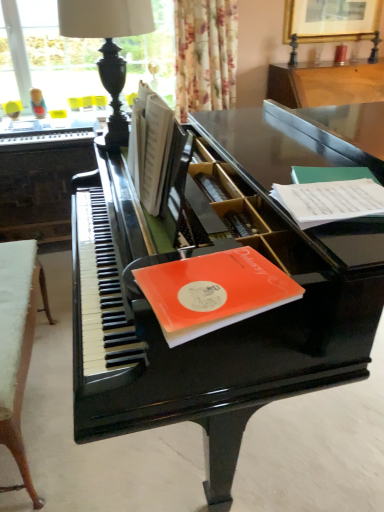
Question: Considering the relative sizes of white paper at right, marked as the second paperback book in a front-to-back arrangement, and white paper book at center in the image provided, is white paper at right, marked as the second paperback book in a front-to-back arrangement, bigger than white paper book at center?

Choices:
 (A) no
 (B) yes

Answer: (A)

Question: Is white paper at right, the second paperback book positioned from the left, closer to camera compared to white paper book at center?

Choices:
 (A) yes
 (B) no

Answer: (A)

Question: Is white paper at right, the first paperback book from the right, wider than white paper book at center?

Choices:
 (A) yes
 (B) no

Answer: (A)

Question: Does white paper at right, the second paperback book positioned from the left, have a lesser width compared to white paper book at center?

Choices:
 (A) no
 (B) yes

Answer: (A)

Question: Is white paper at right, marked as the second paperback book in a front-to-back arrangement, at the left side of white paper book at center?

Choices:
 (A) yes
 (B) no

Answer: (B)

Question: Looking at the image, does black polished wood table lamp at upper left seem bigger or smaller compared to orange matte paper at piano top, placed as the first paperback book when sorted from bottom to top?

Choices:
 (A) big
 (B) small

Answer: (A)

Question: Is black polished wood table lamp at upper left situated inside orange matte paper at piano top, which is the first paperback book from front to back, or outside?

Choices:
 (A) outside
 (B) inside

Answer: (A)

Question: From the image's perspective, is black polished wood table lamp at upper left located above or below orange matte paper at piano top, which is the first paperback book from front to back?

Choices:
 (A) above
 (B) below

Answer: (A)

Question: Visually, is black polished wood table lamp at upper left positioned to the left or to the right of orange matte paper at piano top, which ranks as the second paperback book in back-to-front order?

Choices:
 (A) right
 (B) left

Answer: (B)

Question: In terms of height, does black polished wood table lamp at upper left look taller or shorter compared to black polished piano at left, arranged as the 2th table when viewed from the front?

Choices:
 (A) tall
 (B) short

Answer: (B)

Question: Is black polished wood table lamp at upper left inside or outside of black polished piano at left, the second table from the bottom?

Choices:
 (A) outside
 (B) inside

Answer: (A)

Question: Is black polished wood table lamp at upper left in front of or behind black polished piano at left, marked as the first table in a back-to-front arrangement, in the image?

Choices:
 (A) behind
 (B) front

Answer: (B)

Question: Is black polished wood table lamp at upper left wider or thinner than black polished piano at left, the second table from the bottom?

Choices:
 (A) wide
 (B) thin

Answer: (B)

Question: Considering the positions of glossy black piano at center and white paper at right, arranged as the first paperback book when viewed from the back, in the image, is glossy black piano at center taller or shorter than white paper at right, arranged as the first paperback book when viewed from the back,?

Choices:
 (A) short
 (B) tall

Answer: (B)

Question: Is point (347, 162) closer or farther from the camera than point (299, 222)?

Choices:
 (A) farther
 (B) closer

Answer: (A)